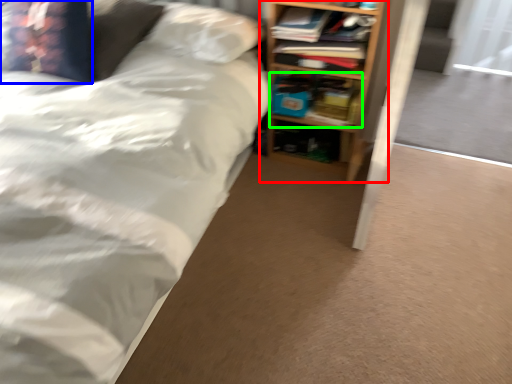
Question: Considering the real-world distances, which object is farthest from shelf (highlighted by a red box)? pillow (highlighted by a blue box) or book (highlighted by a green box)?

Choices:
 (A) pillow
 (B) book

Answer: (A)